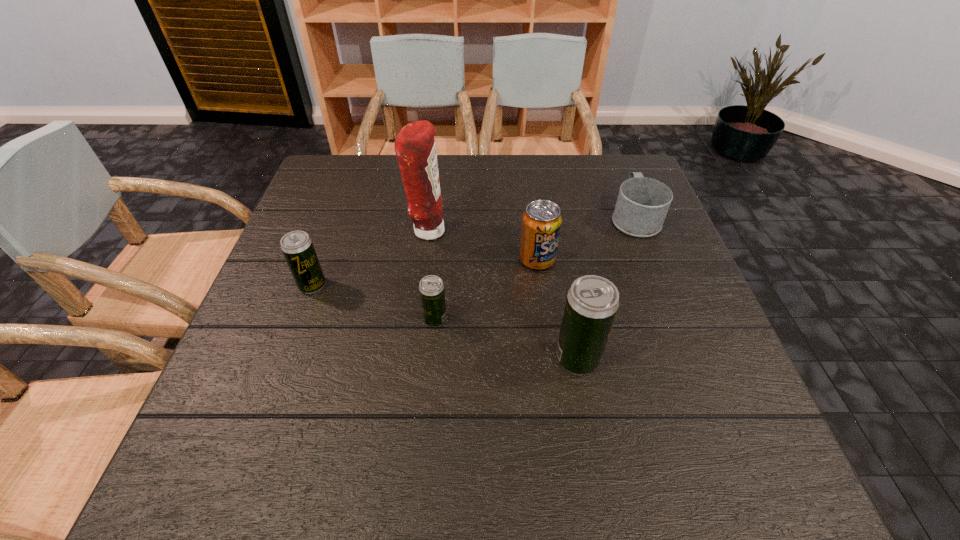
Locate an element on the screen. The height and width of the screenshot is (540, 960). free spot located on the left of the second nearest beer can is located at coordinates (381, 319).

Where is `vacant space located on the right of the tallest beer can`? The height and width of the screenshot is (540, 960). vacant space located on the right of the tallest beer can is located at coordinates (681, 359).

This screenshot has width=960, height=540. Find the location of `blank space located 0.210m on the side of the rightmost object with the handle`. blank space located 0.210m on the side of the rightmost object with the handle is located at coordinates (612, 158).

Find the location of a particular element. The height and width of the screenshot is (540, 960). free space located on the side of the rightmost object with the handle is located at coordinates point(617,172).

Where is `vacant position located 0.060m on the side of the rightmost object with the handle`? vacant position located 0.060m on the side of the rightmost object with the handle is located at coordinates (622, 186).

Locate an element on the screen. The image size is (960, 540). vacant space located on the left of the soda can is located at coordinates (440, 259).

Where is `vacant space located 0.110m on the back of the condiment`? This screenshot has width=960, height=540. vacant space located 0.110m on the back of the condiment is located at coordinates (432, 192).

I want to click on object at the far edge, so click(642, 204).

Locate an element on the screen. Image resolution: width=960 pixels, height=540 pixels. object located at the left edge is located at coordinates (297, 247).

Locate an element on the screen. Image resolution: width=960 pixels, height=540 pixels. object situated at the right edge is located at coordinates (642, 204).